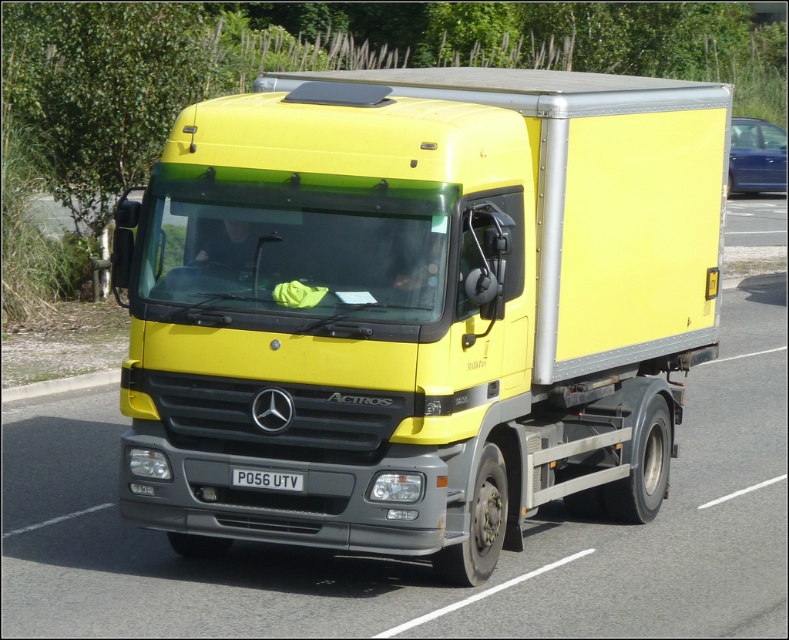
Between point (290, 275) and point (296, 474), which one is positioned in front?

Point (296, 474)

Who is positioned more to the left, yellow matte truck at center or black plastic license plate at center?

Positioned to the left is black plastic license plate at center.

Describe the element at coordinates (417, 307) in the screenshot. The height and width of the screenshot is (640, 789). I see `yellow matte truck at center` at that location.

Identify the location of yellow matte truck at center. (417, 307).